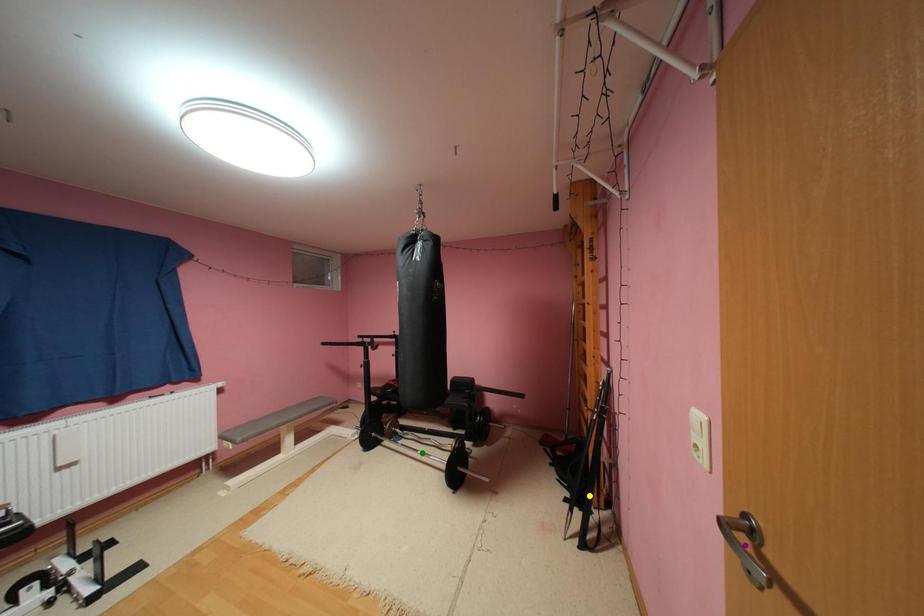
Order these from nearest to farthest:
yellow point
purple point
green point

green point
yellow point
purple point